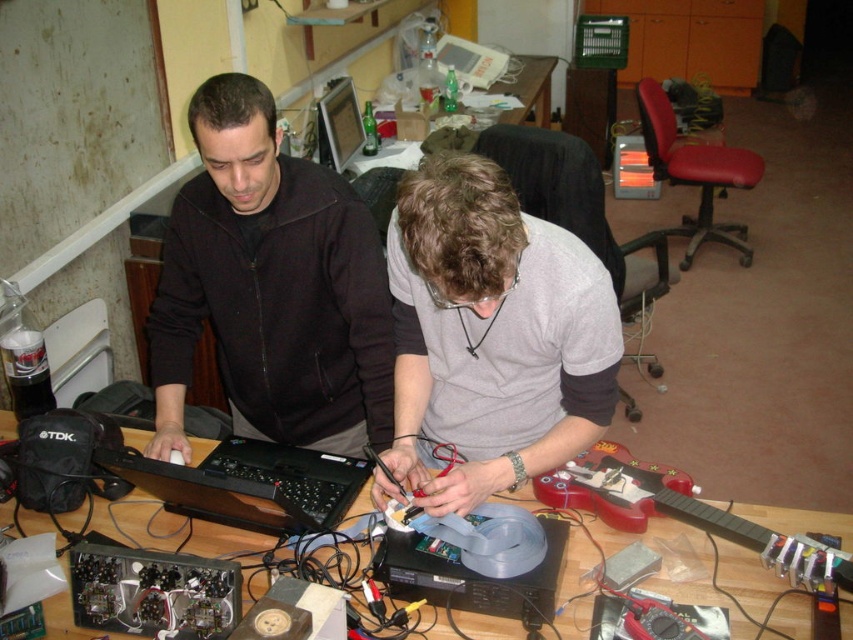
Question: Which object is positioned closest to the gray matte shirt at center?

Choices:
 (A) wooden table at center
 (B) black matte jacket at upper left
 (C) black matte laptop at center

Answer: (B)

Question: Can you confirm if black matte jacket at upper left is positioned to the right of wooden table at center?

Choices:
 (A) no
 (B) yes

Answer: (A)

Question: Which object is closer to the camera taking this photo?

Choices:
 (A) black matte laptop at center
 (B) wooden table at center
 (C) gray matte shirt at center
 (D) black matte jacket at upper left

Answer: (C)

Question: Does black matte jacket at upper left lie in front of black matte laptop at center?

Choices:
 (A) yes
 (B) no

Answer: (B)

Question: Estimate the real-world distances between objects in this image. Which object is farther from the wooden table at center?

Choices:
 (A) black matte laptop at center
 (B) gray matte shirt at center

Answer: (A)

Question: Can you confirm if gray matte shirt at center is positioned to the right of wooden table at center?

Choices:
 (A) yes
 (B) no

Answer: (B)